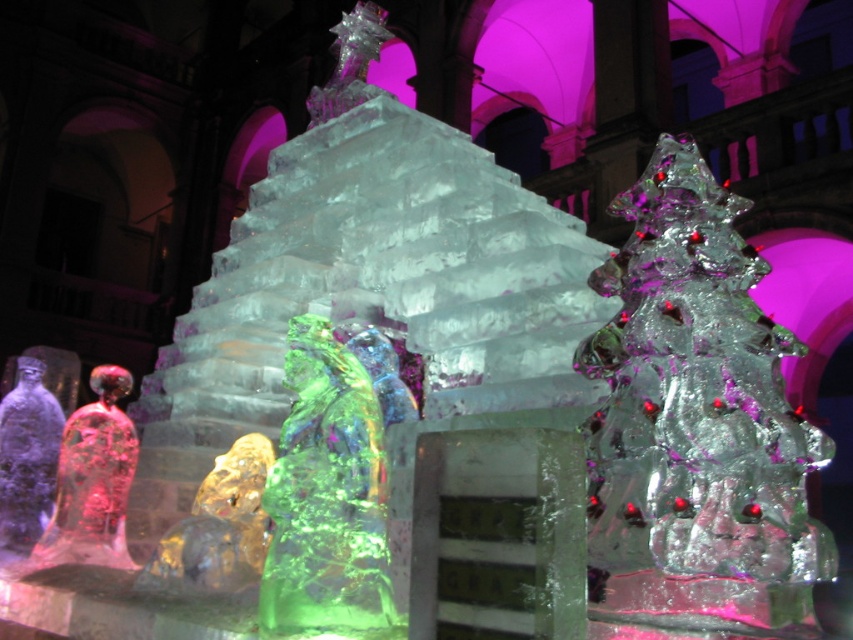
Question: Does transparent ice christmas tree at center appear on the left side of green translucent ice sculpture at center?

Choices:
 (A) yes
 (B) no

Answer: (B)

Question: Which object is positioned farthest from the translucent ice figure at left?

Choices:
 (A) translucent amber bear at center
 (B) green translucent ice sculpture at center

Answer: (B)

Question: Is transparent glass figure at lower left below translucent ice figure at left?

Choices:
 (A) no
 (B) yes

Answer: (B)

Question: Which point is closer to the camera taking this photo?

Choices:
 (A) [349, 561]
 (B) [260, 529]
 (C) [18, 566]

Answer: (A)

Question: Can you confirm if transparent ice christmas tree at center is bigger than green translucent ice sculpture at center?

Choices:
 (A) yes
 (B) no

Answer: (B)

Question: Among these points, which one is farthest from the camera?

Choices:
 (A) (74, 548)
 (B) (26, 404)
 (C) (387, 560)

Answer: (B)